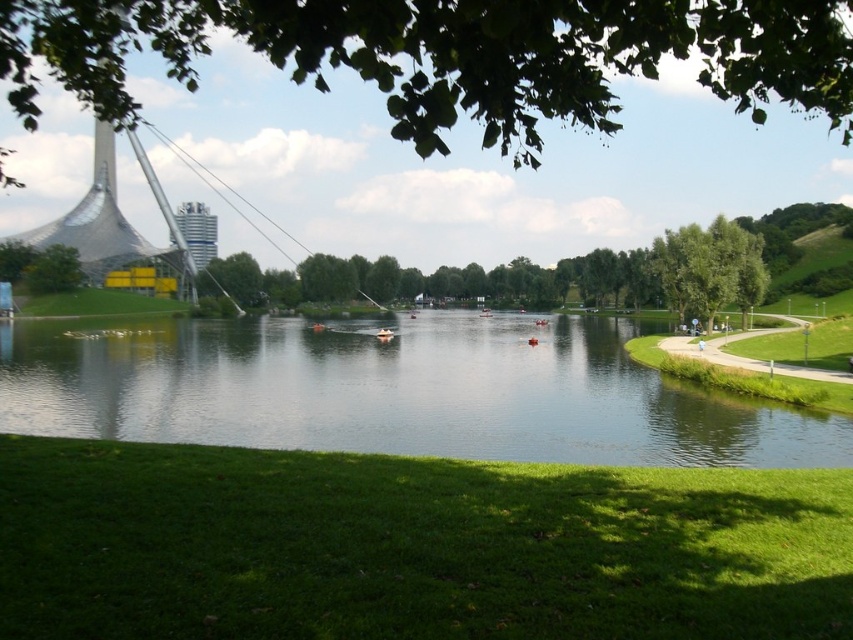
Can you confirm if green leafy tree at upper center is bigger than green leafy tree at left?

Correct, green leafy tree at upper center is larger in size than green leafy tree at left.

Who is more distant from viewer, (817, 100) or (57, 268)?

The point (57, 268) is behind.

Where is `green leafy tree at upper center`? The width and height of the screenshot is (853, 640). green leafy tree at upper center is located at coordinates (451, 54).

Find the location of a particular element. The width and height of the screenshot is (853, 640). green leafy tree at upper center is located at coordinates (451, 54).

Can you confirm if clear water at center is taller than orange rubber boat at center?

Yes, clear water at center is taller than orange rubber boat at center.

Can you confirm if clear water at center is wider than orange rubber boat at center?

Correct, the width of clear water at center exceeds that of orange rubber boat at center.

Between point (668, 428) and point (390, 337), which one is positioned behind?

Positioned behind is point (390, 337).

Where is `clear water at center`? The height and width of the screenshot is (640, 853). clear water at center is located at coordinates pyautogui.click(x=392, y=392).

Can you confirm if green leafy tree at upper center is bigger than orange rubber boat at center?

Yes.

Does point (444, 118) come farther from viewer compared to point (381, 339)?

No, it is not.

At what (x,y) coordinates should I click in order to perform the action: click on green leafy tree at upper center. Please return your answer as a coordinate pair (x, y). The width and height of the screenshot is (853, 640). Looking at the image, I should click on (451, 54).